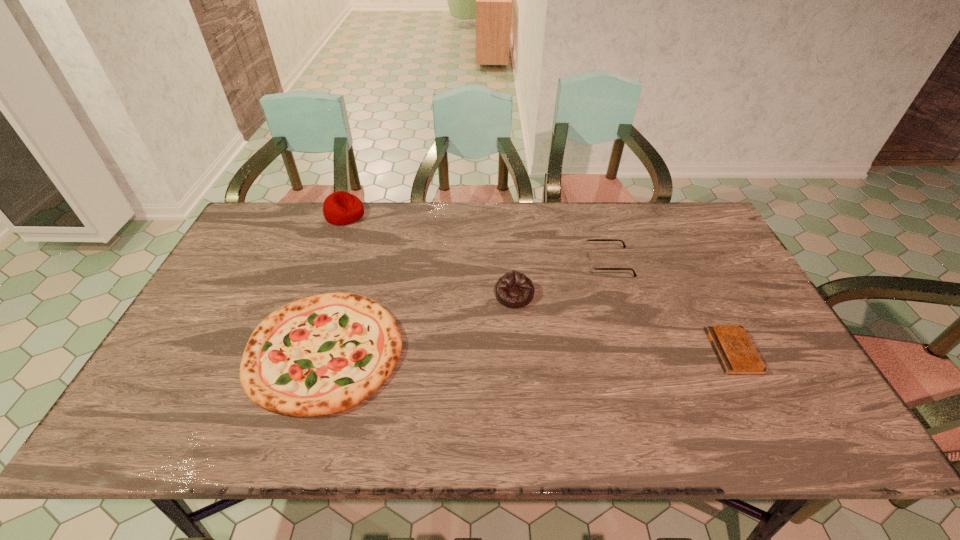
I want to click on object located in the right edge section of the desktop, so click(x=737, y=355).

The image size is (960, 540). In the image, there is a desktop. In order to click on vacant space at the far edge in this screenshot , I will do `click(356, 225)`.

Image resolution: width=960 pixels, height=540 pixels. I want to click on free location at the near edge of the desktop, so click(608, 443).

In order to click on blank space at the left edge in this screenshot , I will do `click(197, 334)`.

Where is `free space at the far left corner`? free space at the far left corner is located at coordinates (248, 233).

The width and height of the screenshot is (960, 540). What are the coordinates of `vacant space at the far right corner of the desktop` in the screenshot? It's located at (710, 233).

Find the location of a particular element. vacant space at the near right corner is located at coordinates (796, 438).

The height and width of the screenshot is (540, 960). I want to click on empty space that is in between the tallest object and the nearer beanbag, so click(430, 255).

Identify the location of empty space that is in between the spectacles and the pizza. This screenshot has height=540, width=960. (467, 307).

The image size is (960, 540). I want to click on free point between the tallest object and the shorter beanbag, so click(x=430, y=255).